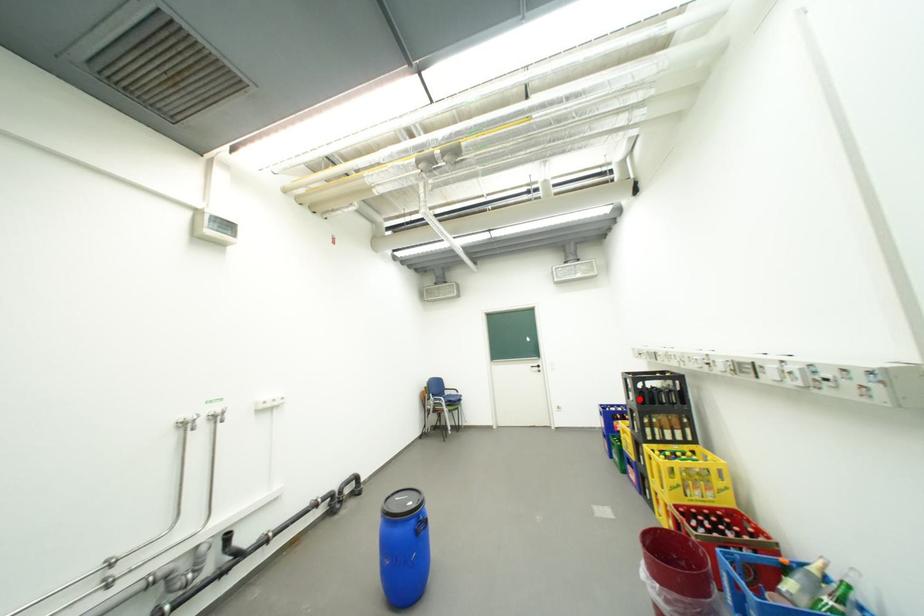
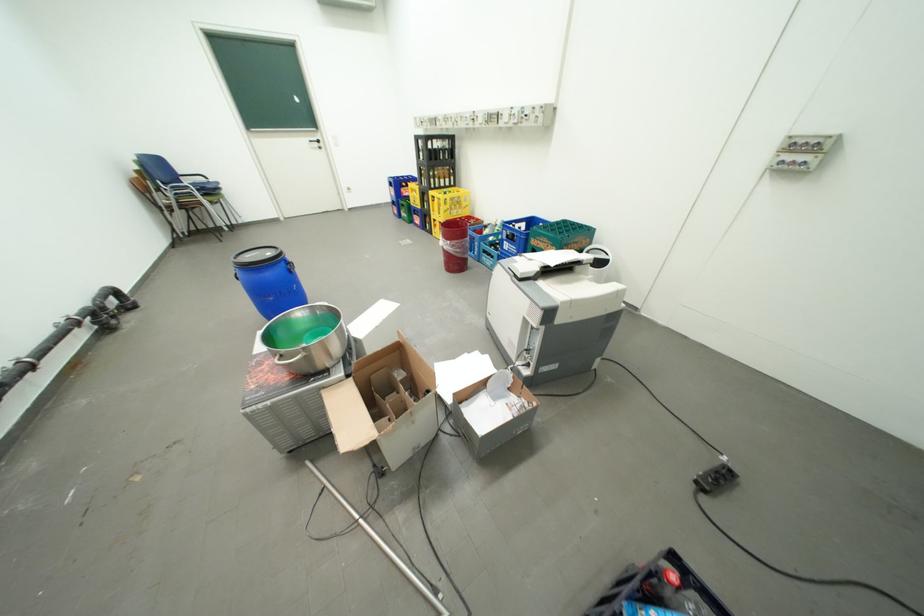
In the second image, find the point that corresponds to the highlighted location in the first image.

(430, 159)